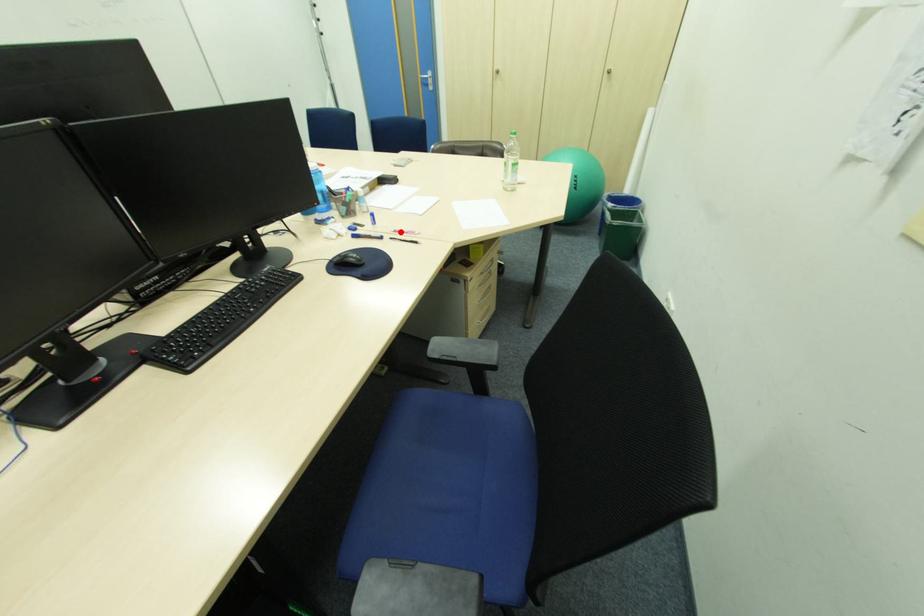
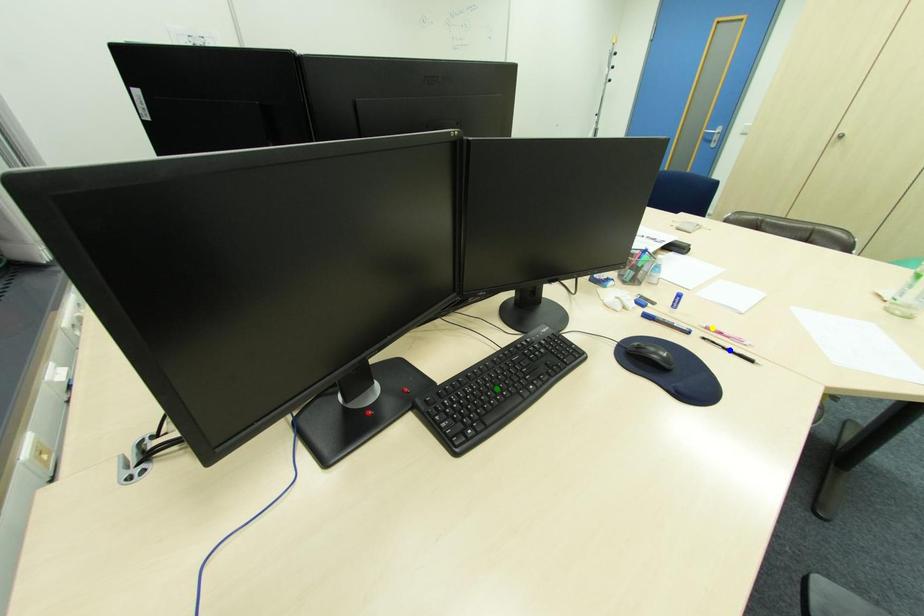
Question: I am providing you with two images of the same scene from different viewpoints. A red point is marked on the first image. You are given multiple points on the second image. Which spot in image 2 lines up with the point in image 1?

Choices:
 (A) yellow point
 (B) green point
 (C) blue point

Answer: (A)